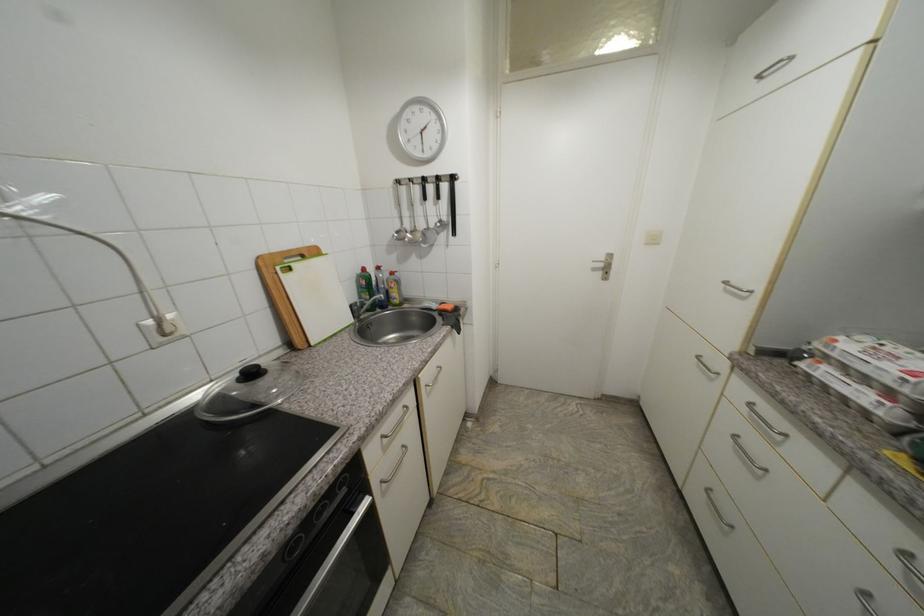
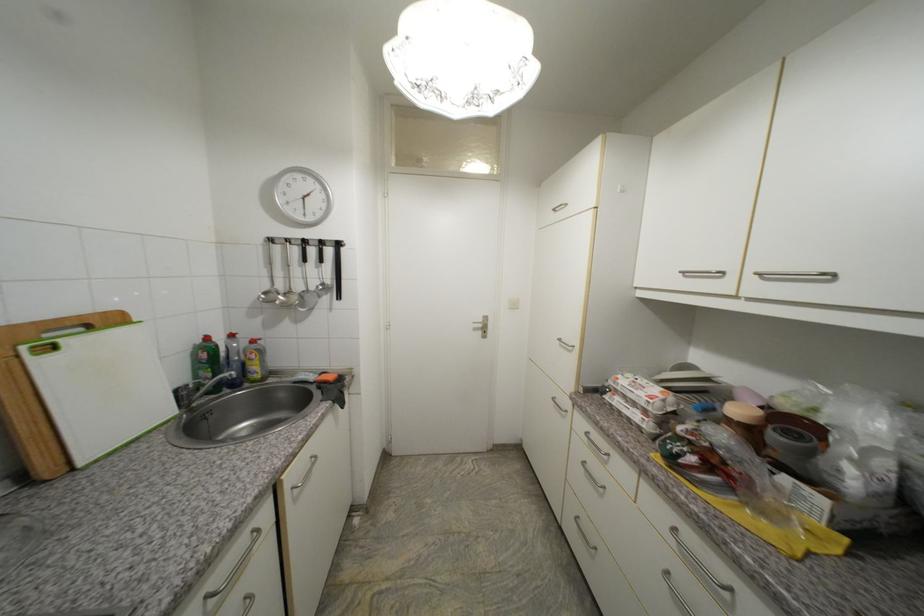
Question: The first image is from the beginning of the video and the second image is from the end. How did the camera likely rotate when shooting the video?

Choices:
 (A) Left
 (B) Right
 (C) Up
 (D) Down

Answer: (B)